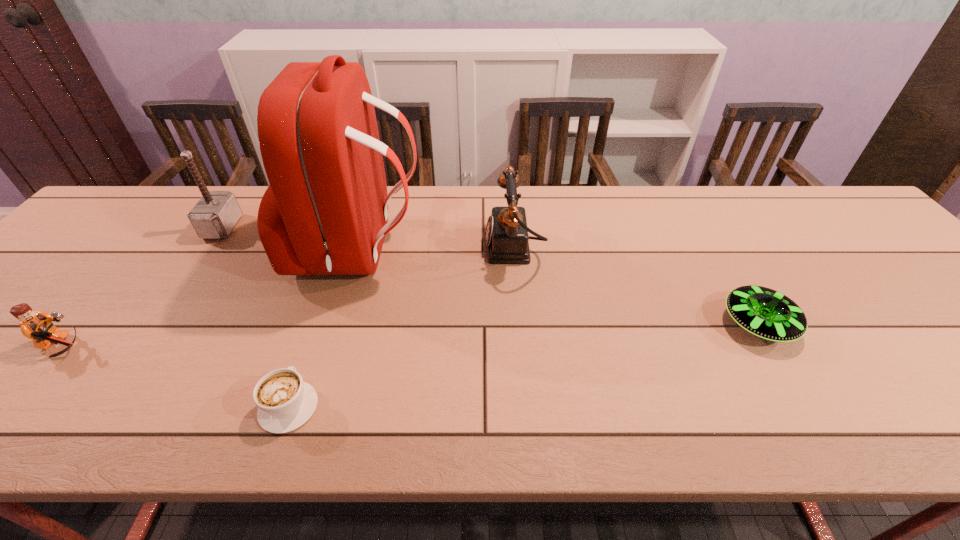
What are the coordinates of `free space between the rightmost object and the leftmost object` in the screenshot? It's located at (411, 335).

Identify the location of vacant space that is in between the second object from right to left and the third shortest object. (289, 297).

Locate an element on the screen. free space that is in between the nearest object and the fifth object from right to left is located at coordinates (256, 316).

Where is `free space between the tallest object and the telephone`? free space between the tallest object and the telephone is located at coordinates (437, 249).

The height and width of the screenshot is (540, 960). What are the coordinates of `free space between the rightmost object and the hammer` in the screenshot? It's located at 491,276.

Find the location of a particular element. The height and width of the screenshot is (540, 960). free area in between the second object from right to left and the shortest object is located at coordinates (401, 327).

Locate an element on the screen. The height and width of the screenshot is (540, 960). vacant area that lies between the fifth shortest object and the cappuccino is located at coordinates (256, 316).

Identify the location of blank region between the fourth shortest object and the cappuccino. The width and height of the screenshot is (960, 540). (401, 327).

Find the location of a particular element. This screenshot has width=960, height=540. blank region between the fourth tallest object and the telephone is located at coordinates (289, 297).

Locate which object ranks in proximity to the shortest object. Please provide its 2D coordinates. Your answer should be formatted as a tuple, i.e. [(x, y)], where the tuple contains the x and y coordinates of a point satisfying the conditions above.

[(325, 212)]